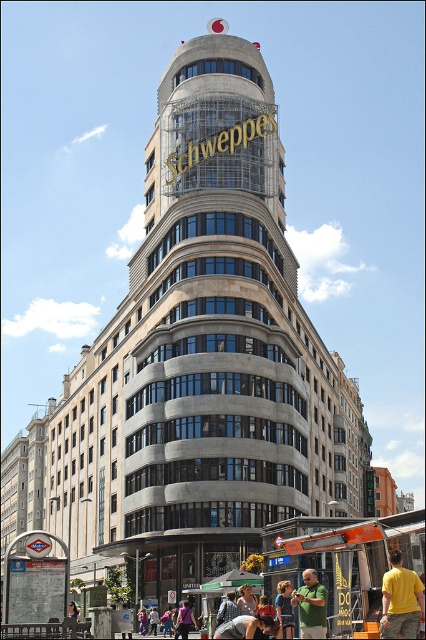
You are standing in front of the building and notice a person wearing a yellow cotton shirt at lower right and blue denim jeans at lower center. From your perspective, which clothing item appears closer to you?

The yellow cotton shirt at lower right appears closer because it is in front of the blue denim jeans at lower center.

You are standing at the corner of the building and want to walk towards the golden Schweppes sign. There are two points marked on the building wall, point A at coordinates point A is point (406, 580) and point B is point (284, 600). Which point is closer to you as you face the building?

Point A at coordinates point (406, 580) is in front of point B at coordinates point (284, 600), so point A is closer to you as you face the building.

You are standing at the base of the building and want to take a photo of the Schweppes sign. There are two points marked on the building wall. One is at point (x=169, y=323) and the other at point (x=313, y=577). Which point is closer to the sign?

Point (x=313, y=577) is closer to the Schweppes sign because it is in front of point (x=169, y=323).